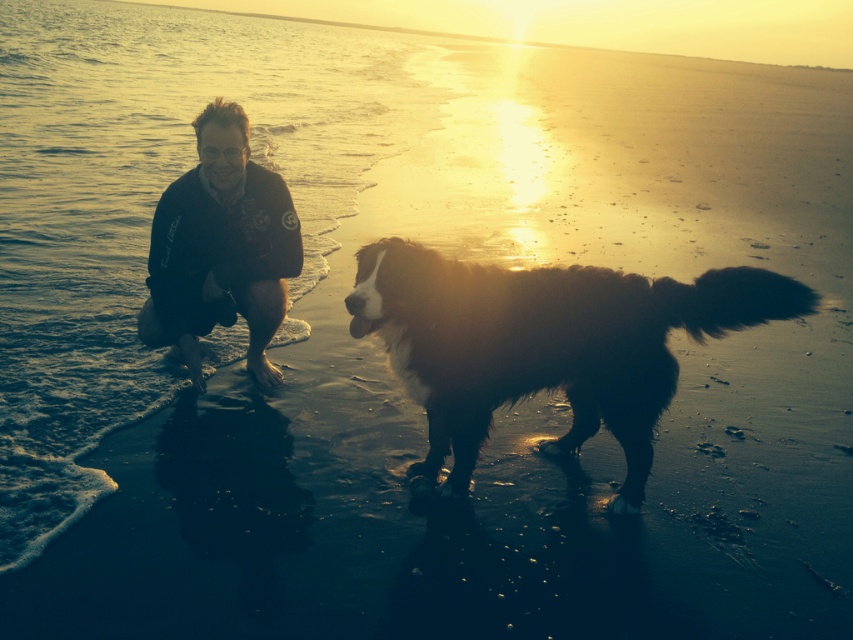
Question: Observing the image, what is the correct spatial positioning of black shaggy dog at center in reference to black softshell jacket at left?

Choices:
 (A) above
 (B) below

Answer: (B)

Question: Observing the image, what is the correct spatial positioning of black shaggy dog at center in reference to black softshell jacket at left?

Choices:
 (A) left
 (B) right

Answer: (B)

Question: Which point appears closest to the camera in this image?

Choices:
 (A) (524, 276)
 (B) (223, 104)

Answer: (A)

Question: Is black shaggy dog at center closer to camera compared to black softshell jacket at left?

Choices:
 (A) no
 (B) yes

Answer: (B)